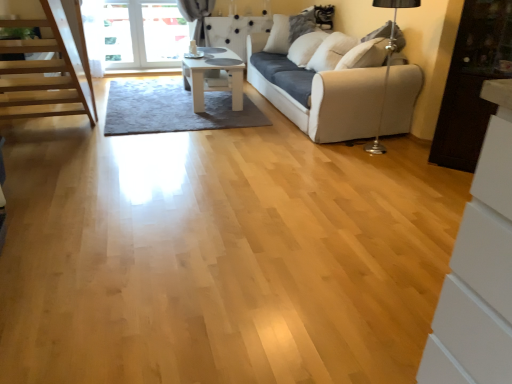
What are the coordinates of `dark wood cabinet at right` in the screenshot? It's located at (472, 82).

What do you see at coordinates (214, 78) in the screenshot?
I see `white glossy table at center` at bounding box center [214, 78].

I want to click on white glossy table at center, so click(x=214, y=78).

Locate an element on the screen. The width and height of the screenshot is (512, 384). white fabric couch at center is located at coordinates (333, 83).

Which is more to the left, dark wood cabinet at right or white soft pillow at upper center?

Positioned to the left is white soft pillow at upper center.

Is dark wood cabinet at right aimed at white soft pillow at upper center?

No.

Where is `cabinetry in front of the white soft pillow at upper center`? The height and width of the screenshot is (384, 512). cabinetry in front of the white soft pillow at upper center is located at coordinates pos(472,82).

At what (x,y) coordinates should I click in order to perform the action: click on table behind the white fabric couch at center. Please return your answer as a coordinate pair (x, y). Looking at the image, I should click on (214, 78).

From the image's perspective, does white glossy table at center appear higher than white fabric couch at center?

No, from the image's perspective, white glossy table at center is not on top of white fabric couch at center.

Can you confirm if white glossy table at center is shorter than white fabric couch at center?

Yes.

Is white glossy table at center inside the boundaries of white fabric couch at center, or outside?

white glossy table at center is spatially situated outside white fabric couch at center.

Considering the sizes of objects white soft pillow at upper center and dark wood cabinet at right in the image provided, who is shorter, white soft pillow at upper center or dark wood cabinet at right?

With less height is white soft pillow at upper center.

Identify the location of pillow that is behind the dark wood cabinet at right. The image size is (512, 384). (289, 30).

Which is closer to the camera, (298,20) or (469,124)?

Point (469,124)

Is white soft pillow at upper center positioned with its back to dark wood cabinet at right?

No.

Is white glossy table at center placed right next to dark wood cabinet at right?

No, white glossy table at center is not with dark wood cabinet at right.

Considering the sizes of objects white glossy table at center and dark wood cabinet at right in the image provided, who is shorter, white glossy table at center or dark wood cabinet at right?

white glossy table at center is shorter.

Considering the relative positions of white glossy table at center and dark wood cabinet at right in the image provided, is white glossy table at center behind dark wood cabinet at right?

Yes.

Which point is more distant from viewer, (221, 62) or (484, 31)?

Point (221, 62)

Which of these two, dark wood cabinet at right or white fabric couch at center, is thinner?

dark wood cabinet at right.

From the image's perspective, relative to white fabric couch at center, is dark wood cabinet at right above or below?

From the image's perspective, dark wood cabinet at right appears below white fabric couch at center.

Can you see dark wood cabinet at right touching white fabric couch at center?

No, dark wood cabinet at right is not touching white fabric couch at center.

Would you say white soft pillow at upper center is inside or outside white fabric couch at center?

white soft pillow at upper center is located inside white fabric couch at center.

Does white soft pillow at upper center come in front of white fabric couch at center?

No, white soft pillow at upper center is further to the viewer.

Is point (272, 32) closer to camera compared to point (399, 116)?

That is False.

From the image's perspective, is white soft pillow at upper center above or below white fabric couch at center?

white soft pillow at upper center is above white fabric couch at center.

Looking at their sizes, would you say white glossy table at center is wider or thinner than white soft pillow at upper center?

In the image, white glossy table at center appears to be wider than white soft pillow at upper center.

Could you tell me if white glossy table at center is turned towards white soft pillow at upper center?

No, white glossy table at center is not facing towards white soft pillow at upper center.

From the image's perspective, is white glossy table at center on top of white soft pillow at upper center?

No.

At what (x,y) coordinates should I click in order to perform the action: click on pillow located above the dark wood cabinet at right (from a real-world perspective). Please return your answer as a coordinate pair (x, y). The height and width of the screenshot is (384, 512). Looking at the image, I should click on (289, 30).

Find the location of a particular element. The image size is (512, 384). table on the left of the white fabric couch at center is located at coordinates (214, 78).

From the image, which object appears to be farther from white fabric couch at center, white glossy table at center or dark wood cabinet at right?

Based on the image, dark wood cabinet at right appears to be further to white fabric couch at center.

When comparing their distances from white glossy table at center, does dark wood cabinet at right or white soft pillow at upper center seem closer?

white soft pillow at upper center lies closer to white glossy table at center than the other object.

From the image, which object appears to be nearer to white soft pillow at upper center, dark wood cabinet at right or white fabric couch at center?

white fabric couch at center.

From the image, which object appears to be farther from white glossy table at center, white soft pillow at upper center or white fabric couch at center?

A: white soft pillow at upper center is further to white glossy table at center.

Based on their spatial positions, is white soft pillow at upper center or dark wood cabinet at right closer to white fabric couch at center?

Based on the image, dark wood cabinet at right appears to be nearer to white fabric couch at center.

Based on their spatial positions, is white fabric couch at center or white soft pillow at upper center further from white glossy table at center?

white soft pillow at upper center is positioned further to the anchor white glossy table at center.

From the picture: Based on their spatial positions, is dark wood cabinet at right or white glossy table at center further from white fabric couch at center?

dark wood cabinet at right lies further to white fabric couch at center than the other object.

From the image, which object appears to be farther from white soft pillow at upper center, dark wood cabinet at right or white glossy table at center?

Based on the image, dark wood cabinet at right appears to be further to white soft pillow at upper center.

The height and width of the screenshot is (384, 512). Find the location of `studio couch positioned between dark wood cabinet at right and white soft pillow at upper center from near to far`. studio couch positioned between dark wood cabinet at right and white soft pillow at upper center from near to far is located at coordinates (333, 83).

I want to click on studio couch located between white glossy table at center and dark wood cabinet at right in the left-right direction, so click(333, 83).

At what (x,y) coordinates should I click in order to perform the action: click on table between dark wood cabinet at right and white soft pillow at upper center along the z-axis. Please return your answer as a coordinate pair (x, y). The image size is (512, 384). Looking at the image, I should click on (214, 78).

I want to click on table positioned between white fabric couch at center and white soft pillow at upper center from near to far, so [x=214, y=78].